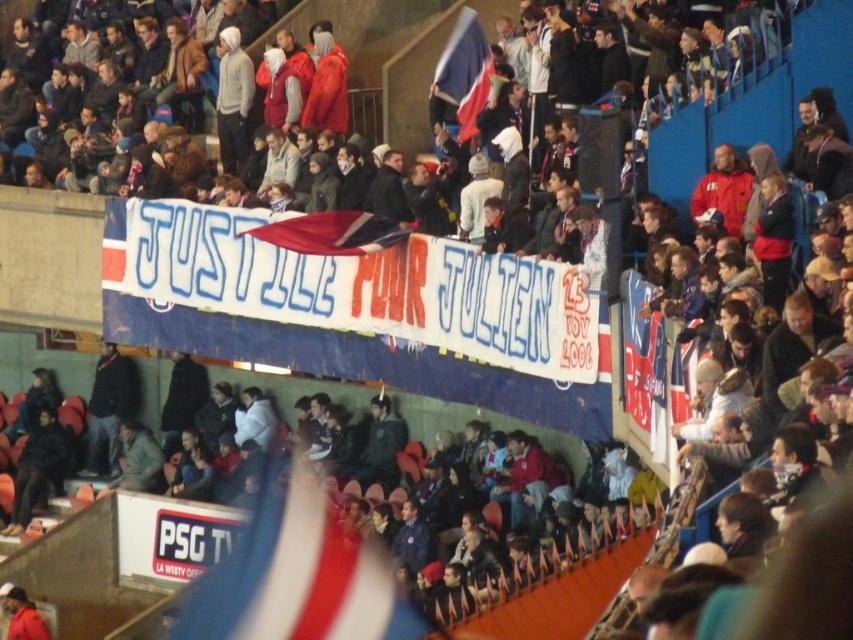
Question: Which of the following is the closest to the observer?

Choices:
 (A) red fabric banner at center
 (B) blue fabric banner at center

Answer: (A)

Question: Does dark blue jacket at center appear under red fabric banner at center?

Choices:
 (A) no
 (B) yes

Answer: (B)

Question: Is red fabric banner at center to the right of red and white striped flag at upper center from the viewer's perspective?

Choices:
 (A) no
 (B) yes

Answer: (B)

Question: Based on their relative distances, which object is nearer to the red and white striped flag at upper center?

Choices:
 (A) red fabric flag at lower center
 (B) dark blue jacket at center

Answer: (B)

Question: Which point is closer to the camera taking this photo?

Choices:
 (A) (631, 557)
 (B) (476, 109)
 (C) (372, 227)

Answer: (A)

Question: Is the position of red fabric flag at center more distant than that of red and white striped flag at upper center?

Choices:
 (A) no
 (B) yes

Answer: (A)